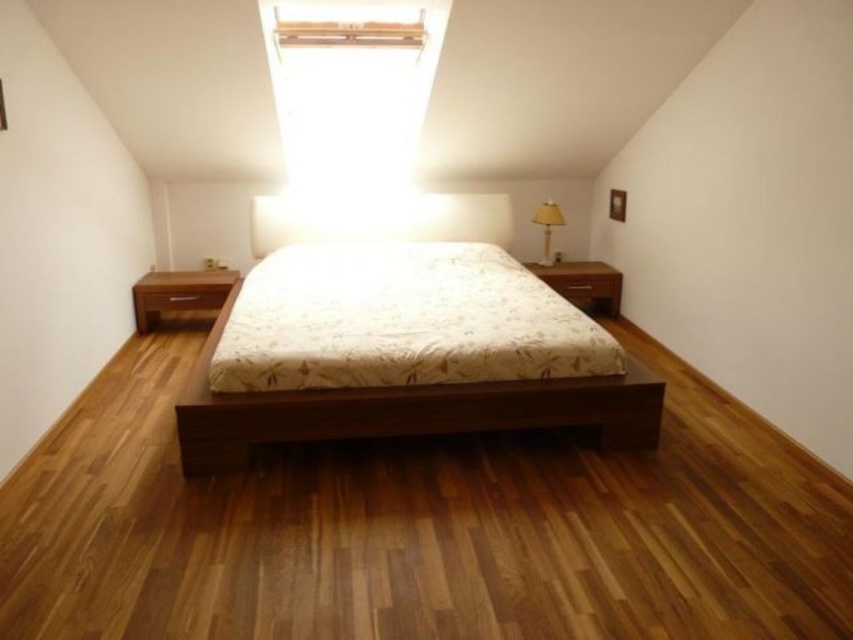
Does point (146, 304) come closer to viewer compared to point (582, 280)?

Yes, point (146, 304) is in front of point (582, 280).

Who is higher up, wooden nightstand at left or brown wood dresser at right?

brown wood dresser at right is higher up.

At what (x,y) coordinates should I click in order to perform the action: click on wooden nightstand at left. Please return your answer as a coordinate pair (x, y). Image resolution: width=853 pixels, height=640 pixels. Looking at the image, I should click on (178, 296).

Between point (378, 45) and point (611, 289), which one is positioned in front?

Point (378, 45)

Does transparent glass skylight at upper center have a larger size compared to brown matte drawer at right?

Correct, transparent glass skylight at upper center is larger in size than brown matte drawer at right.

Does point (303, 60) come in front of point (561, 291)?

Yes, point (303, 60) is in front of point (561, 291).

You are a GUI agent. You are given a task and a screenshot of the screen. Output one action in this format:
    pyautogui.click(x=<x>, y=<y>)
    Task: Click on the transparent glass skylight at upper center
    
    Given the screenshot: What is the action you would take?
    pyautogui.click(x=351, y=88)

Is point (560, 264) positioned behind point (198, 292)?

That is True.

Which is more to the left, brown wood dresser at right or matte brown drawer at left?

From the viewer's perspective, matte brown drawer at left appears more on the left side.

The image size is (853, 640). What do you see at coordinates (583, 284) in the screenshot?
I see `brown wood dresser at right` at bounding box center [583, 284].

What are the coordinates of `brown wood dresser at right` in the screenshot? It's located at (583, 284).